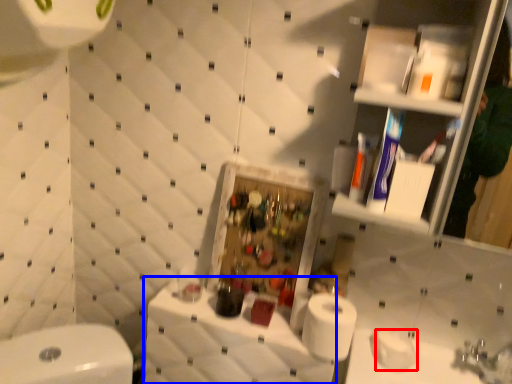
Question: Which object appears closest to the camera in this image, toilet paper (highlighted by a red box) or counter top (highlighted by a blue box)?

Choices:
 (A) toilet paper
 (B) counter top

Answer: (B)